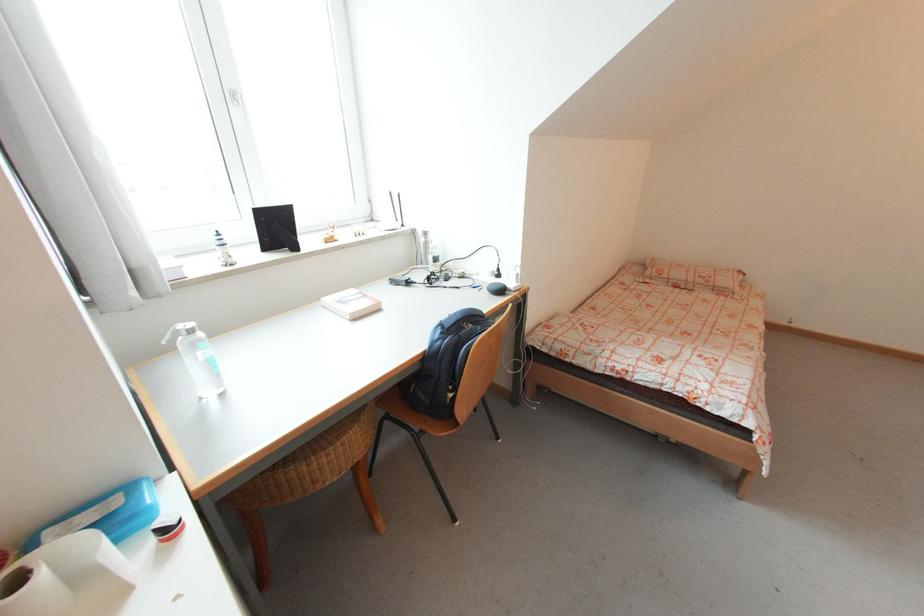
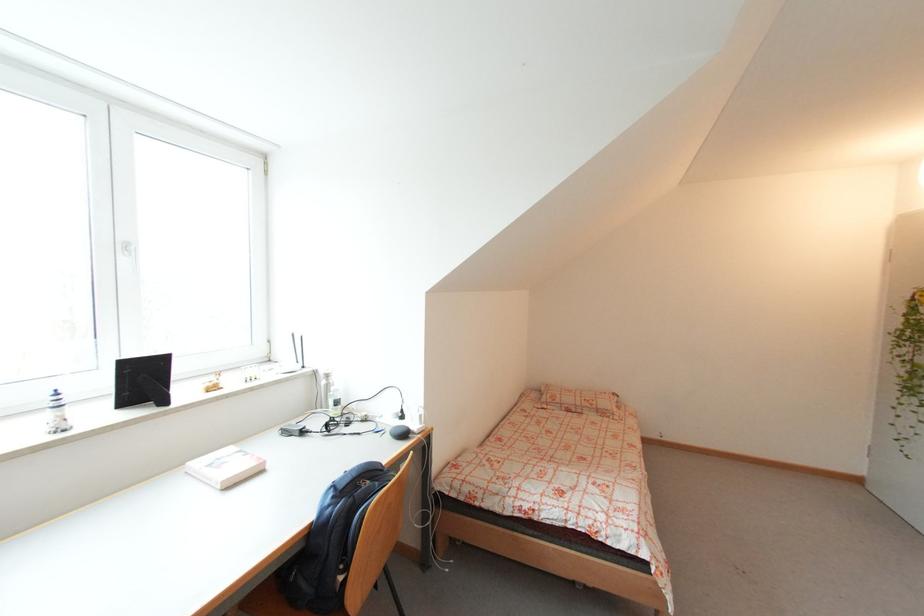
Find the pixel in the second image that matches (357,292) in the first image.

(236, 450)